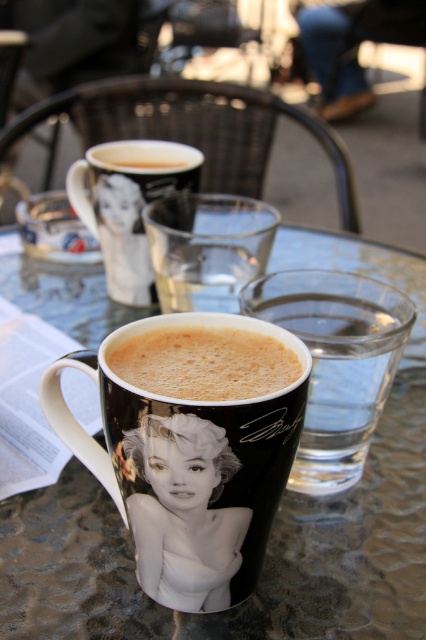
Is transparent glass table at center above foamy white coffee at upper center?

No, transparent glass table at center is not above foamy white coffee at upper center.

Where is `transparent glass table at center`? The image size is (426, 640). transparent glass table at center is located at coordinates (271, 529).

In order to click on transparent glass table at center in this screenshot , I will do `click(271, 529)`.

Can you confirm if foamy brown coffee at center is bigger than foamy white coffee at upper center?

Incorrect, foamy brown coffee at center is not larger than foamy white coffee at upper center.

The image size is (426, 640). In order to click on foamy brown coffee at center in this screenshot , I will do `click(204, 362)`.

This screenshot has width=426, height=640. Identify the location of foamy brown coffee at center. tap(204, 362).

Is black glossy mug at center smaller than transparent glass at center?

No, black glossy mug at center is not smaller than transparent glass at center.

Does black glossy mug at center appear on the left side of transparent glass at center?

Correct, you'll find black glossy mug at center to the left of transparent glass at center.

Does point (157, 358) come in front of point (218, 193)?

Yes, it is.

At what (x,y) coordinates should I click in order to perform the action: click on black glossy mug at center. Please return your answer as a coordinate pair (x, y). Looking at the image, I should click on (192, 444).